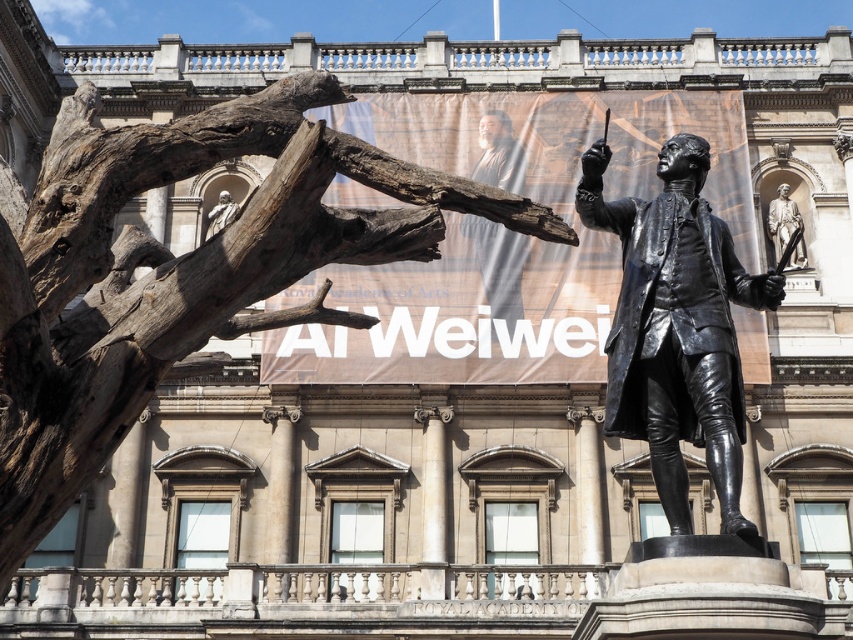
What is the exact location of the brown textured fabric at upper center in the image?

The brown textured fabric at upper center is located at point (498, 266).

You are an art student who needs to take a photo of the bronze statue at upper right from a position where the brown textured fabric at upper center is also visible in the frame. Given that your camera has a 50mm lens, which has a field of view of approximately 46 degrees, can you estimate if both objects will fit in the frame at the same time?

The distance between the brown textured fabric at upper center and the bronze statue at upper right is 19.15 meters. To determine if both can fit in the camera frame with a 46 degree field of view, we can use trigonometry. The maximum distance covered by the field of view would be calculated using the tangent of half the angle multiplied by the distance from the camera. However, without knowing the exact distance from the camera to the objects, it is impossible to accurately determine if they fit. More data